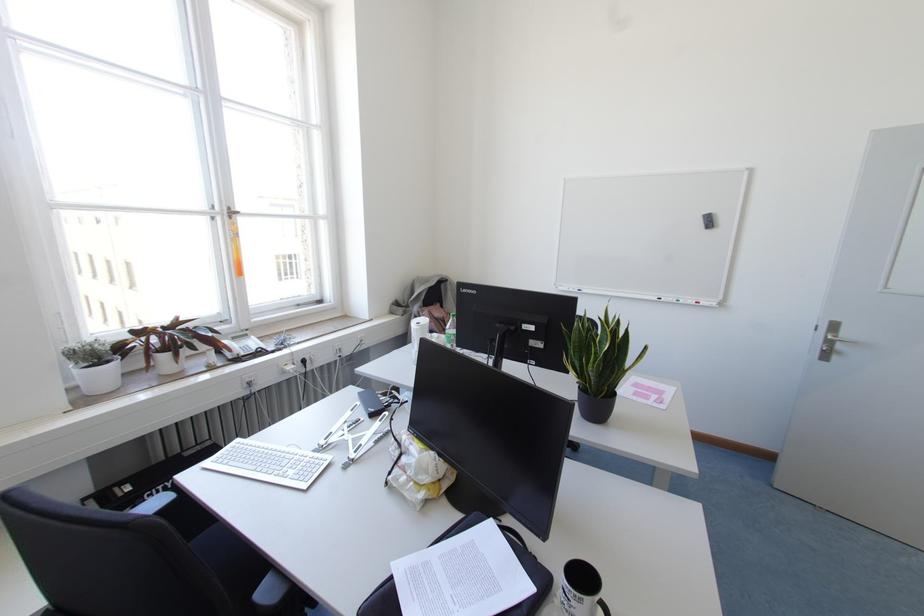
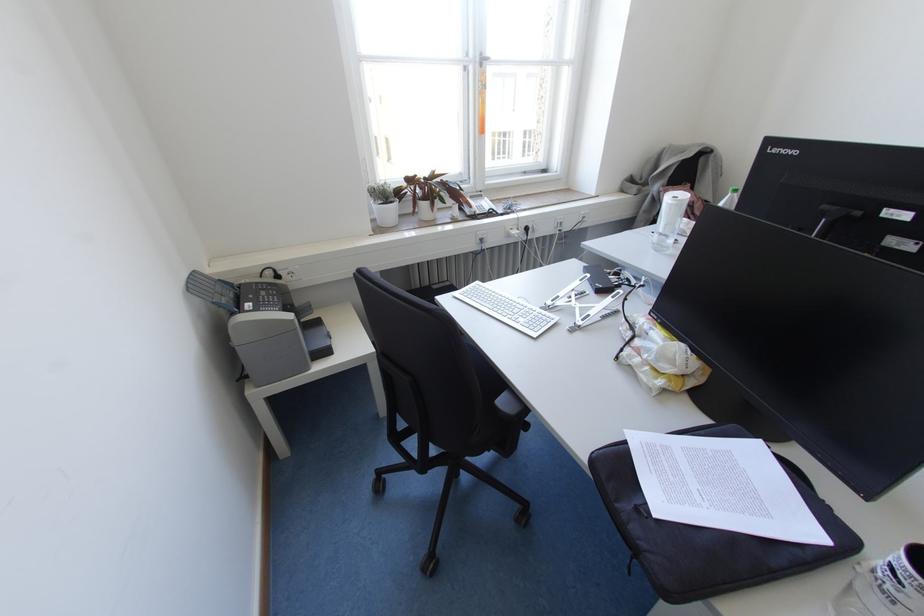
The point at (104, 344) is marked in the first image. Where is the corresponding point in the second image?

(390, 187)